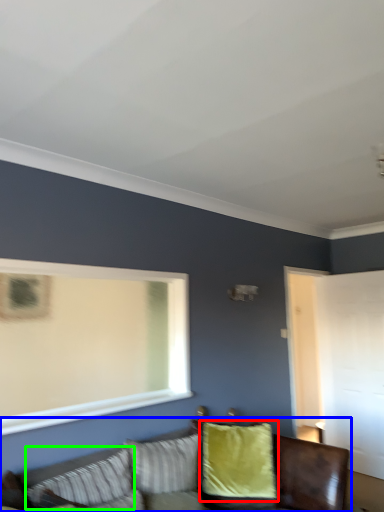
Question: Estimate the real-world distances between objects in this image. Which object is closer to pillow (highlighted by a red box), studio couch (highlighted by a blue box) or pillow (highlighted by a green box)?

Choices:
 (A) studio couch
 (B) pillow

Answer: (A)